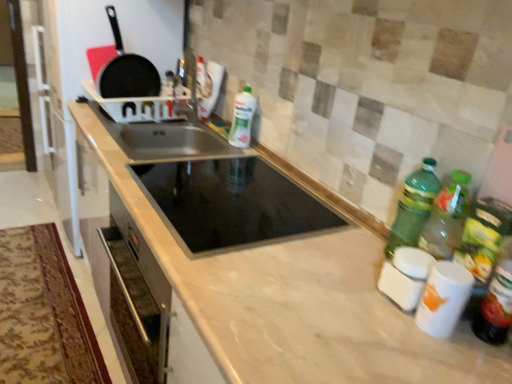
Question: Is white glossy canisters at lower right behind stainless steel sink at center, the first sink positioned from the back?

Choices:
 (A) no
 (B) yes

Answer: (A)

Question: Are white glossy canisters at lower right and stainless steel sink at center, the first sink positioned from the back, located far from each other?

Choices:
 (A) no
 (B) yes

Answer: (B)

Question: Is white glossy canisters at lower right oriented towards stainless steel sink at center, the first sink positioned from the back?

Choices:
 (A) yes
 (B) no

Answer: (B)

Question: From the image's perspective, does white glossy canisters at lower right appear lower than stainless steel sink at center, which appears as the 2th sink when viewed from the front?

Choices:
 (A) yes
 (B) no

Answer: (A)

Question: Is stainless steel sink at center, the first sink positioned from the back, a part of white glossy canisters at lower right?

Choices:
 (A) yes
 (B) no

Answer: (B)

Question: Is white glossy canisters at lower right to the left or to the right of green plastic bottle at right, the 2th bottle positioned from the top, in the image?

Choices:
 (A) left
 (B) right

Answer: (A)

Question: From a real-world perspective, is white glossy canisters at lower right physically located above or below green plastic bottle at right, the 2th bottle when ordered from left to right?

Choices:
 (A) above
 (B) below

Answer: (B)

Question: Is white glossy canisters at lower right inside or outside of green plastic bottle at right, the 2th bottle positioned from the top?

Choices:
 (A) outside
 (B) inside

Answer: (A)

Question: Does point (444, 273) appear closer or farther from the camera than point (437, 180)?

Choices:
 (A) closer
 (B) farther

Answer: (A)

Question: Is marble countertop at center spatially inside matte black frying pan at upper left, or outside of it?

Choices:
 (A) inside
 (B) outside

Answer: (B)

Question: Considering the positions of point (361, 354) and point (138, 69), is point (361, 354) closer or farther from the camera than point (138, 69)?

Choices:
 (A) farther
 (B) closer

Answer: (B)

Question: From a real-world perspective, is marble countertop at center above or below matte black frying pan at upper left?

Choices:
 (A) below
 (B) above

Answer: (A)

Question: In terms of width, does marble countertop at center look wider or thinner when compared to matte black frying pan at upper left?

Choices:
 (A) wide
 (B) thin

Answer: (A)

Question: Considering the positions of white glossy bottle at center, the 1th bottle in the top-to-bottom sequence, and black glass sink at center, the 1th sink viewed from the front, in the image, is white glossy bottle at center, the 1th bottle in the top-to-bottom sequence, wider or thinner than black glass sink at center, the 1th sink viewed from the front,?

Choices:
 (A) thin
 (B) wide

Answer: (A)

Question: From the image's perspective, is white glossy bottle at center, which is the 3th bottle in bottom-to-top order, located above or below black glass sink at center, the 1th sink viewed from the front?

Choices:
 (A) below
 (B) above

Answer: (B)